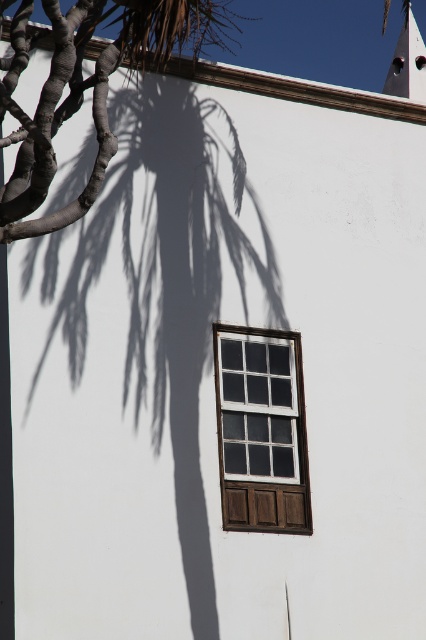
Which of these two, brown textured trunk at left or white wood window at center, stands shorter?

Standing shorter between the two is white wood window at center.

Does brown textured trunk at left appear on the left side of white wood window at center?

Correct, you'll find brown textured trunk at left to the left of white wood window at center.

In order to click on brown textured trunk at left in this screenshot , I will do `click(131, 378)`.

From the picture: Is brown textured trunk at left below dark brown textured branches at left?

Indeed, brown textured trunk at left is positioned under dark brown textured branches at left.

Can you confirm if brown textured trunk at left is bigger than dark brown textured branches at left?

Incorrect, brown textured trunk at left is not larger than dark brown textured branches at left.

What are the coordinates of `brown textured trunk at left` in the screenshot? It's located at (131, 378).

Consider the image. How distant is dark brown textured branches at left from white wood window at center?

dark brown textured branches at left is 5.87 meters away from white wood window at center.

Can you confirm if dark brown textured branches at left is shorter than white wood window at center?

In fact, dark brown textured branches at left may be taller than white wood window at center.

Does point (152, 26) come farther from viewer compared to point (233, 456)?

No, (152, 26) is in front of (233, 456).

You are a GUI agent. You are given a task and a screenshot of the screen. Output one action in this format:
    pyautogui.click(x=<x>, y=<y>)
    Task: Click on the dark brown textured branches at left
    This screenshot has height=640, width=426.
    Given the screenshot: What is the action you would take?
    pyautogui.click(x=86, y=90)